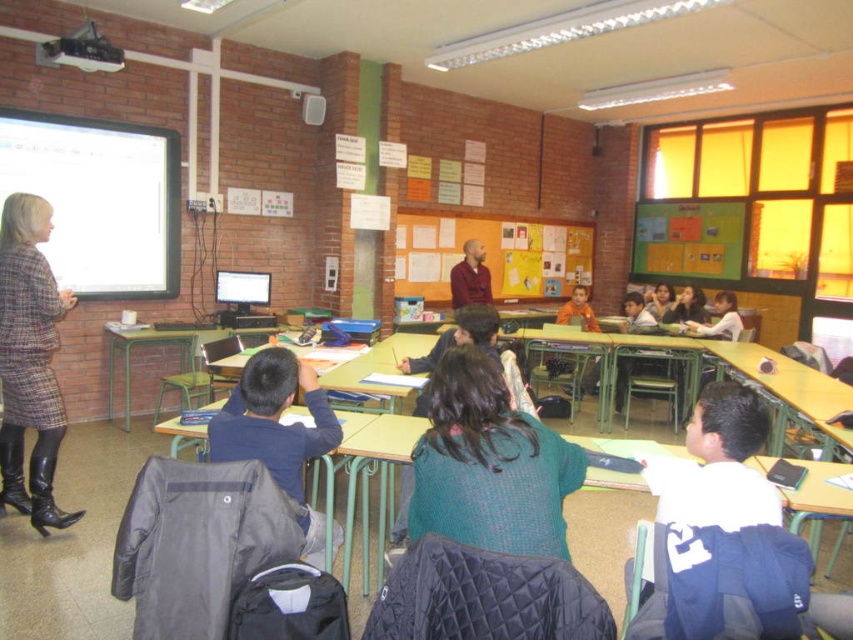
Between point (825, 417) and point (664, 358), which one is positioned in front?

Positioned in front is point (825, 417).

Identify the location of wooden desk at lower right. (788, 394).

Who is more distant from viewer, (527, 461) or (22, 385)?

Point (22, 385)

Does point (479, 424) come closer to viewer compared to point (13, 490)?

Yes, point (479, 424) is in front of point (13, 490).

Who is more distant from viewer, (433, 371) or (12, 284)?

Point (12, 284)

Find the location of `green knitted sweater at center`. green knitted sweater at center is located at coordinates (489, 465).

Who is higher up, yellow paperboard at center or brown shirt at center?

yellow paperboard at center is above.

Between yellow paperboard at center and brown shirt at center, which one is positioned lower?

Positioned lower is brown shirt at center.

Describe the element at coordinates (490, 256) in the screenshot. I see `yellow paperboard at center` at that location.

Where is `yellow paperboard at center`? yellow paperboard at center is located at coordinates (490, 256).